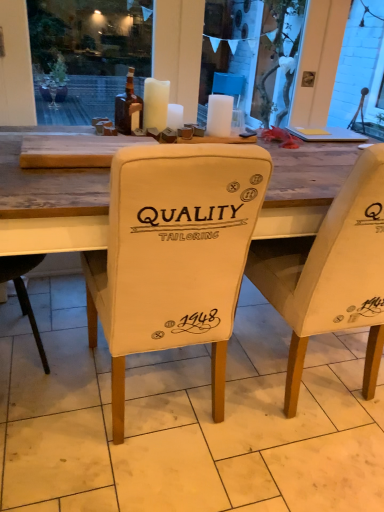
Locate an element on the screen. This screenshot has height=512, width=384. free space in front of beige fabric chair at center, positioned as the second chair in left-to-right order is located at coordinates (291, 465).